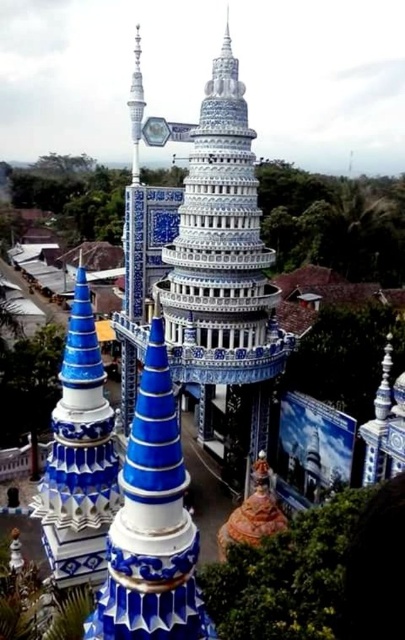
Can you confirm if blue glossy tower at center is positioned above white glossy spire at upper center?

No.

Does blue glossy tower at center appear on the right side of white glossy spire at upper center?

Correct, you'll find blue glossy tower at center to the right of white glossy spire at upper center.

Between point (98, 413) and point (132, 90), which one is positioned in front?

Positioned in front is point (98, 413).

You are a GUI agent. You are given a task and a screenshot of the screen. Output one action in this format:
    pyautogui.click(x=<x>, y=<y>)
    Task: Click on the blue glossy tower at center
    This screenshot has height=640, width=405.
    Given the screenshot: What is the action you would take?
    pyautogui.click(x=78, y=456)